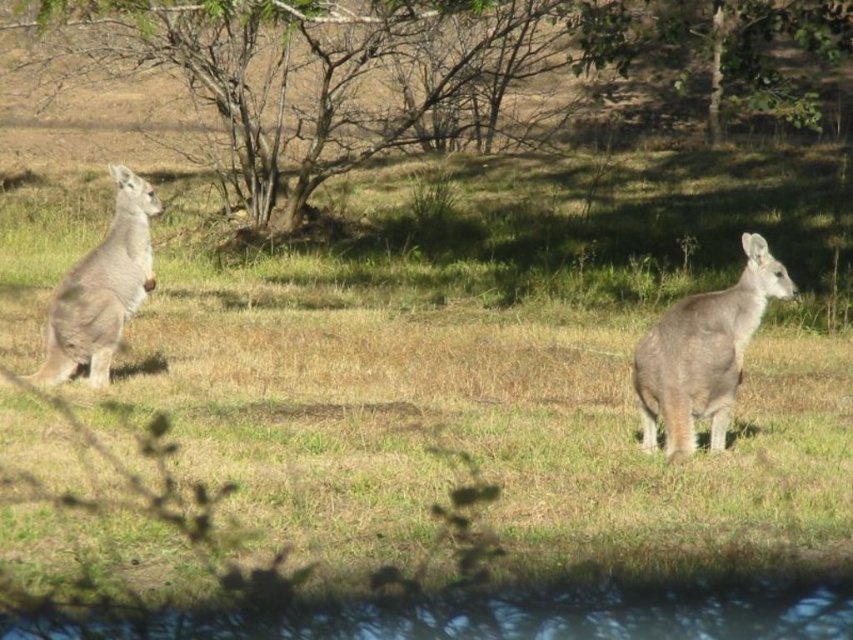
Question: Estimate the real-world distances between objects in this image. Which object is farther from the gray fur kangaroo at right?

Choices:
 (A) brown bark tree at upper center
 (B) green grass at center
 (C) gray furry kangaroo at left

Answer: (A)

Question: Is green grass at center to the left of brown bark tree at upper center from the viewer's perspective?

Choices:
 (A) yes
 (B) no

Answer: (B)

Question: Which of the following is the farthest from the observer?

Choices:
 (A) green grass at center
 (B) gray fur kangaroo at right
 (C) gray furry kangaroo at left
 (D) brown bark tree at upper center

Answer: (D)

Question: From the image, what is the correct spatial relationship of brown bark tree at upper center in relation to gray fur kangaroo at right?

Choices:
 (A) left
 (B) right

Answer: (A)

Question: Does brown bark tree at upper center have a larger size compared to gray furry kangaroo at left?

Choices:
 (A) yes
 (B) no

Answer: (A)

Question: Which object is farther from the camera taking this photo?

Choices:
 (A) gray fur kangaroo at right
 (B) green grass at center

Answer: (A)